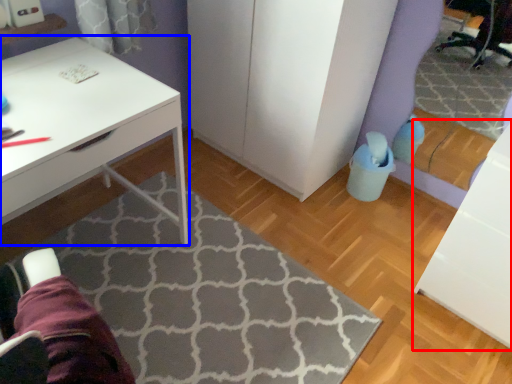
Question: Which of the following is the farthest to the observer, file cabinet (highlighted by a red box) or desk (highlighted by a blue box)?

Choices:
 (A) file cabinet
 (B) desk

Answer: (A)